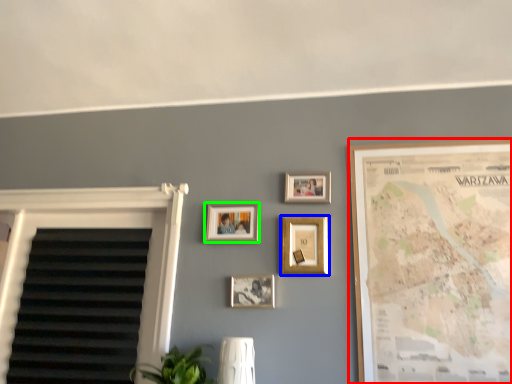
Question: Which object is the farthest from picture frame (highlighted by a red box)? Choose among these: picture frame (highlighted by a blue box) or picture frame (highlighted by a green box).

Choices:
 (A) picture frame
 (B) picture frame

Answer: (B)